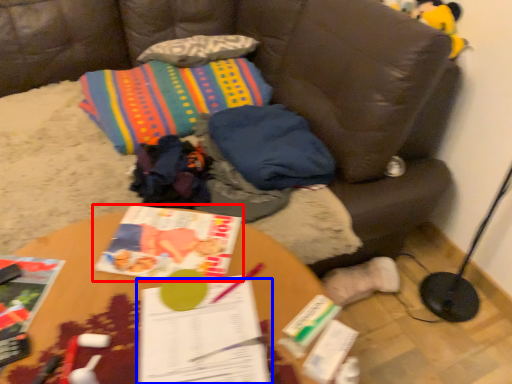
Question: Which object appears closest to the camera in this image, book (highlighted by a red box) or book (highlighted by a blue box)?

Choices:
 (A) book
 (B) book

Answer: (B)